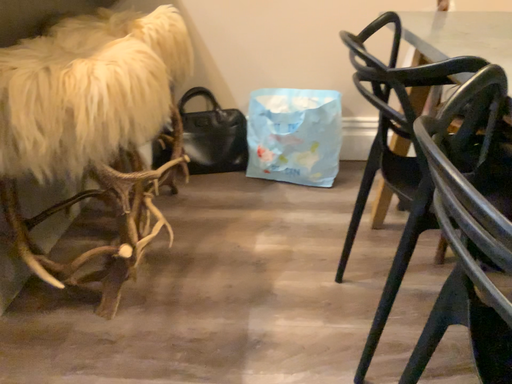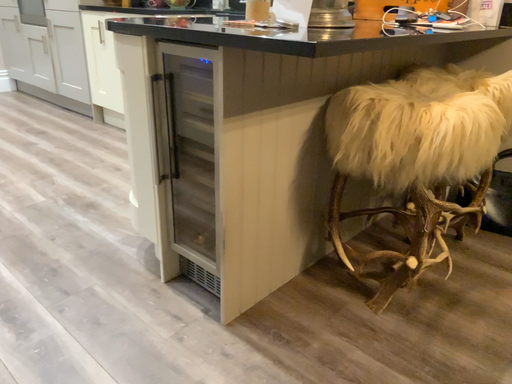
Question: How did the camera likely rotate when shooting the video?

Choices:
 (A) rotated upward
 (B) rotated downward

Answer: (A)